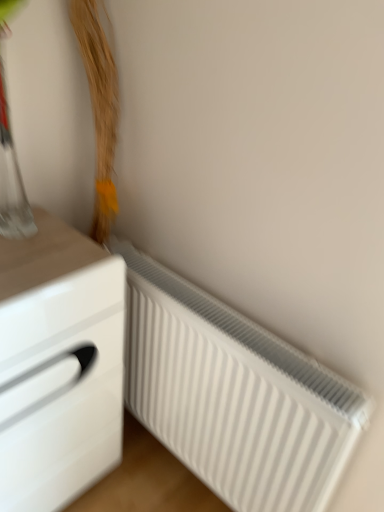
Question: Based on their sizes in the image, would you say white ribbed radiator at lower right is bigger or smaller than white glossy chest of drawers at left?

Choices:
 (A) big
 (B) small

Answer: (B)

Question: Is white ribbed radiator at lower right spatially inside white glossy chest of drawers at left, or outside of it?

Choices:
 (A) inside
 (B) outside

Answer: (B)

Question: Considering the positions of white ribbed radiator at lower right and white glossy chest of drawers at left in the image, is white ribbed radiator at lower right wider or thinner than white glossy chest of drawers at left?

Choices:
 (A) wide
 (B) thin

Answer: (B)

Question: Is white glossy chest of drawers at left inside or outside of white ribbed radiator at lower right?

Choices:
 (A) outside
 (B) inside

Answer: (A)

Question: Considering the positions of white glossy chest of drawers at left and white ribbed radiator at lower right in the image, is white glossy chest of drawers at left wider or thinner than white ribbed radiator at lower right?

Choices:
 (A) wide
 (B) thin

Answer: (A)

Question: Is white glossy chest of drawers at left in front of or behind white ribbed radiator at lower right in the image?

Choices:
 (A) front
 (B) behind

Answer: (A)

Question: Considering the positions of point (44, 423) and point (233, 487), is point (44, 423) closer or farther from the camera than point (233, 487)?

Choices:
 (A) closer
 (B) farther

Answer: (A)